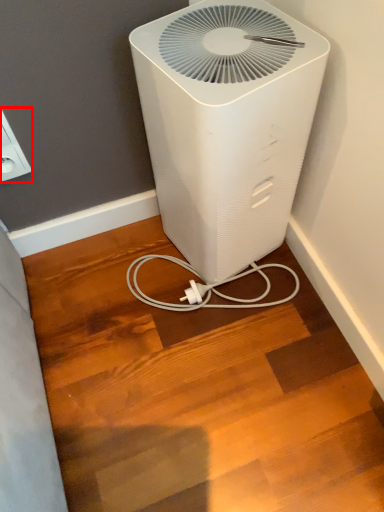
Question: In this image, where is electric outlet (annotated by the red box) located relative to home appliance?

Choices:
 (A) left
 (B) right

Answer: (A)